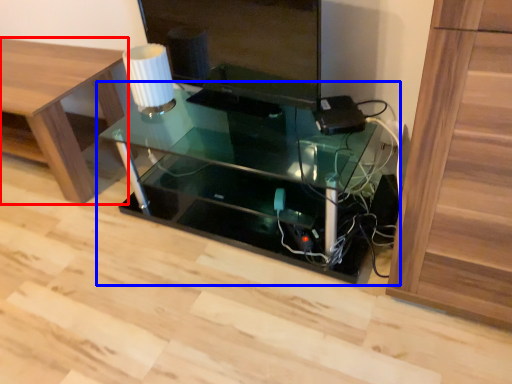
Question: Which of the following is the closest to the observer, furniture (highlighted by a red box) or table (highlighted by a blue box)?

Choices:
 (A) furniture
 (B) table

Answer: (B)